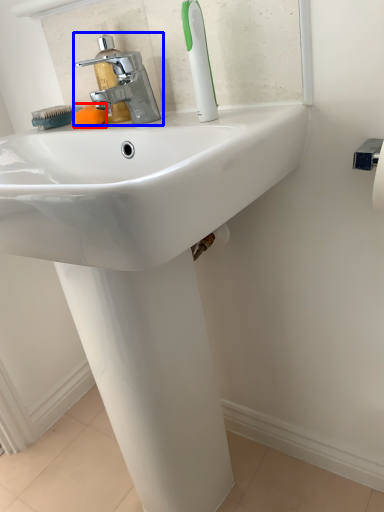
Question: Which object appears closest to the camera in this image, soap (highlighted by a red box) or tap (highlighted by a blue box)?

Choices:
 (A) soap
 (B) tap

Answer: (B)